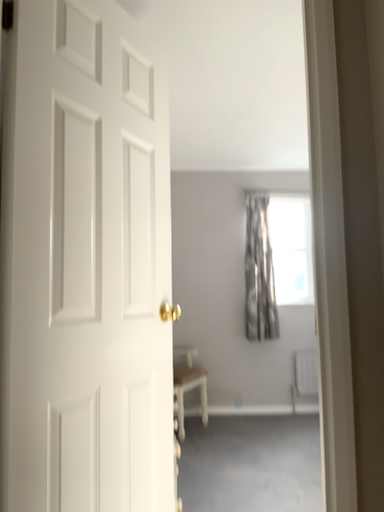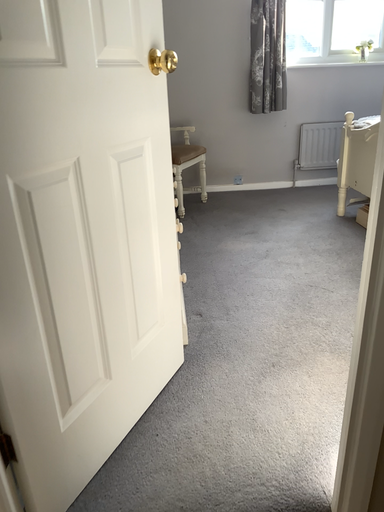
Question: How did the camera likely rotate when shooting the video?

Choices:
 (A) rotated downward
 (B) rotated upward

Answer: (A)